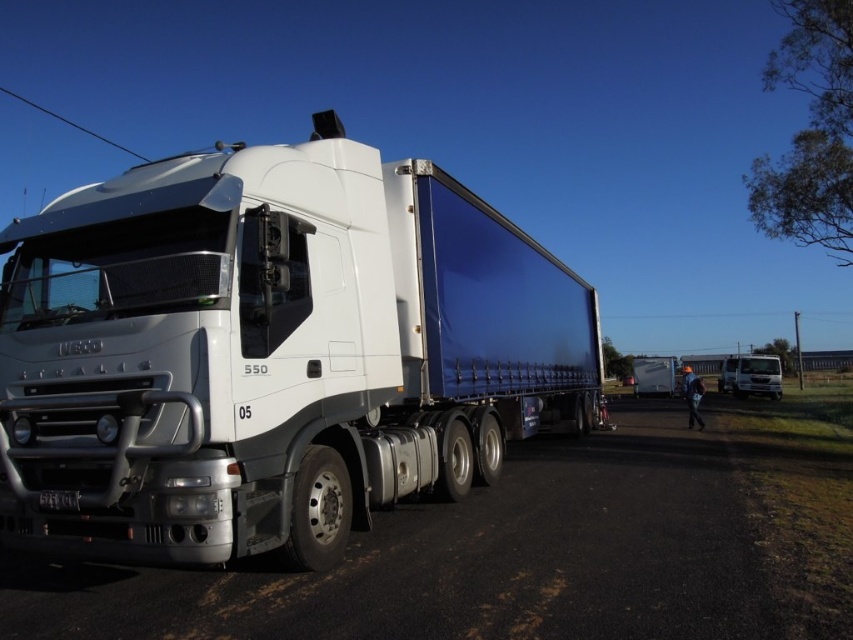
Question: Which of the following is the closest to the observer?

Choices:
 (A) (572, 392)
 (B) (653, 372)
 (C) (750, 385)

Answer: (A)

Question: Is white glossy trailer truck at center closer to camera compared to matte blue trailer at center?

Choices:
 (A) yes
 (B) no

Answer: (A)

Question: Observing the image, what is the correct spatial positioning of white glossy trailer truck at center in reference to matte blue trailer at center?

Choices:
 (A) above
 (B) below

Answer: (A)

Question: Which object appears farthest from the camera in this image?

Choices:
 (A) white matte truck at right
 (B) white glossy trailer truck at center

Answer: (A)

Question: Which point is closer to the camera taking this photo?

Choices:
 (A) (730, 376)
 (B) (561, 353)

Answer: (B)

Question: Is white glossy trailer truck at center to the left of matte blue trailer at center from the viewer's perspective?

Choices:
 (A) no
 (B) yes

Answer: (B)